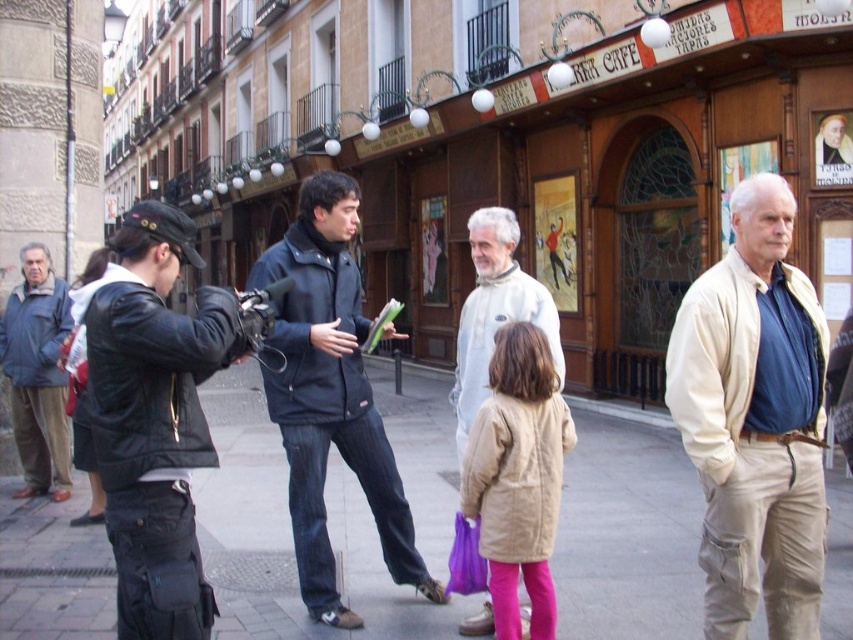
Question: Is paved stone sidewalk at center to the left of beige fabric coat at center from the viewer's perspective?

Choices:
 (A) no
 (B) yes

Answer: (B)

Question: Which point is closer to the camera taking this photo?

Choices:
 (A) (152, 616)
 (B) (511, 481)

Answer: (A)

Question: Which point is closer to the camera taking this photo?

Choices:
 (A) (120, 429)
 (B) (399, 502)
 (C) (786, 237)

Answer: (A)

Question: Among these points, which one is farthest from the camera?

Choices:
 (A) (662, 493)
 (B) (184, 326)
 (C) (521, 346)
 (D) (769, 598)

Answer: (A)

Question: Can you confirm if beige cotton jacket at right is positioned to the left of dark blue jacket at center?

Choices:
 (A) no
 (B) yes

Answer: (A)

Question: Can you confirm if dark blue jacket at center is positioned to the right of beige fabric coat at center?

Choices:
 (A) yes
 (B) no

Answer: (B)